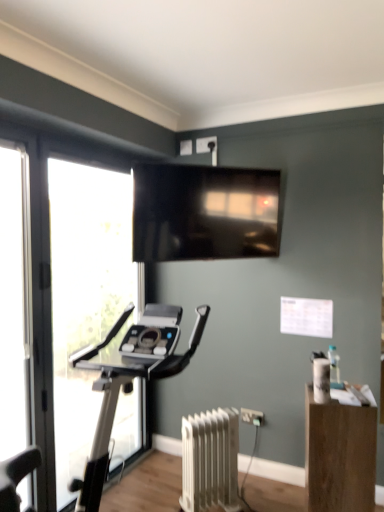
Question: Does wooden box at lower right contain transparent glass window at left?

Choices:
 (A) yes
 (B) no

Answer: (B)

Question: Considering the relative sizes of wooden box at lower right and transparent glass window at left in the image provided, is wooden box at lower right smaller than transparent glass window at left?

Choices:
 (A) no
 (B) yes

Answer: (B)

Question: From a real-world perspective, is wooden box at lower right over transparent glass window at left?

Choices:
 (A) no
 (B) yes

Answer: (A)

Question: Is wooden box at lower right positioned before transparent glass window at left?

Choices:
 (A) yes
 (B) no

Answer: (A)

Question: Can we say wooden box at lower right lies outside transparent glass window at left?

Choices:
 (A) no
 (B) yes

Answer: (B)

Question: From a real-world perspective, is matte black tv at upper center above or below transparent glass window at left?

Choices:
 (A) below
 (B) above

Answer: (B)

Question: In terms of width, does matte black tv at upper center look wider or thinner when compared to transparent glass window at left?

Choices:
 (A) wide
 (B) thin

Answer: (B)

Question: In terms of height, does matte black tv at upper center look taller or shorter compared to transparent glass window at left?

Choices:
 (A) short
 (B) tall

Answer: (A)

Question: Looking at the image, does matte black tv at upper center seem bigger or smaller compared to transparent glass window at left?

Choices:
 (A) big
 (B) small

Answer: (B)

Question: Is matte black tv at upper center in front of or behind wooden box at lower right in the image?

Choices:
 (A) behind
 (B) front

Answer: (A)

Question: Is matte black tv at upper center bigger or smaller than wooden box at lower right?

Choices:
 (A) small
 (B) big

Answer: (A)

Question: Is matte black tv at upper center spatially inside wooden box at lower right, or outside of it?

Choices:
 (A) inside
 (B) outside

Answer: (B)

Question: In terms of width, does matte black tv at upper center look wider or thinner when compared to wooden box at lower right?

Choices:
 (A) thin
 (B) wide

Answer: (A)

Question: Looking at the image, does wooden box at lower right seem bigger or smaller compared to clear glass screen door at left?

Choices:
 (A) big
 (B) small

Answer: (A)

Question: Looking at their shapes, would you say wooden box at lower right is wider or thinner than clear glass screen door at left?

Choices:
 (A) wide
 (B) thin

Answer: (A)